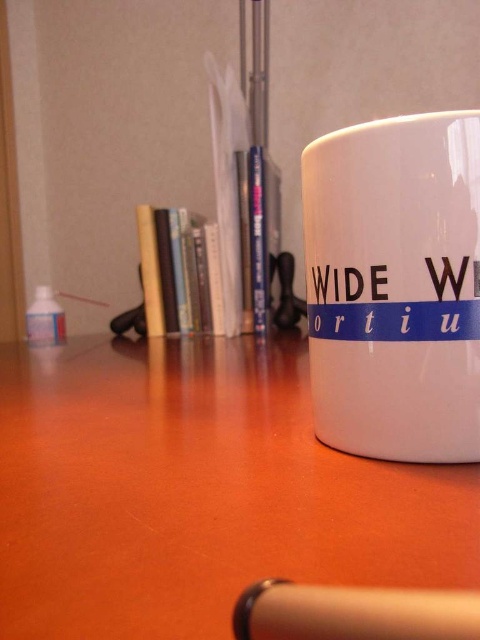
Locate an element on the screen. This screenshot has height=640, width=480. white ceramic mug at right is located at coordinates (395, 285).

Who is positioned more to the right, white ceramic mug at right or metallic silver pen at lower center?

white ceramic mug at right

What do you see at coordinates (395, 285) in the screenshot?
I see `white ceramic mug at right` at bounding box center [395, 285].

I want to click on white ceramic mug at right, so click(x=395, y=285).

Which is more to the right, matte wood table at center or metallic silver pen at lower center?

metallic silver pen at lower center is more to the right.

Is matte wood table at center smaller than metallic silver pen at lower center?

Incorrect, matte wood table at center is not smaller in size than metallic silver pen at lower center.

Between point (45, 627) and point (459, 592), which one is positioned in front?

Positioned in front is point (45, 627).

The width and height of the screenshot is (480, 640). Find the location of `matte wood table at center`. matte wood table at center is located at coordinates (196, 492).

Between matte wood table at center and white ceramic mug at right, which one appears on the right side from the viewer's perspective?

Positioned to the right is white ceramic mug at right.

Is matte wood table at center to the left of white ceramic mug at right from the viewer's perspective?

Indeed, matte wood table at center is positioned on the left side of white ceramic mug at right.

Is point (119, 561) farther from viewer compared to point (326, 280)?

No, (119, 561) is in front of (326, 280).

This screenshot has height=640, width=480. I want to click on matte wood table at center, so click(x=196, y=492).